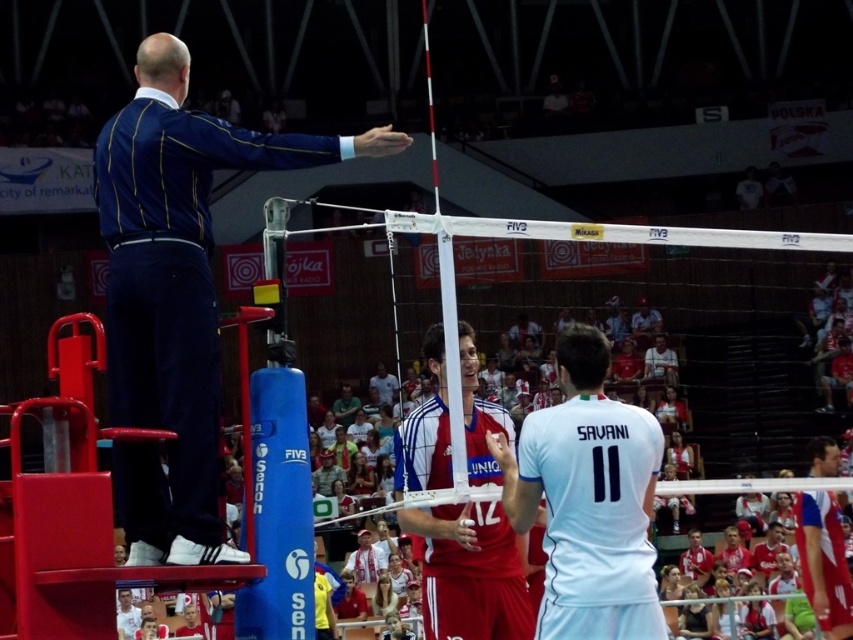
What is the 2D coordinate of the blue striped suit at upper left in the volleyball match scene?

The blue striped suit at upper left is located at the 2D coordinate point of [177,294].

You are a photographer standing at the back of the arena. You want to take a picture of the white jersey at center without the blue striped suit at upper left blocking it. Is this possible?

The blue striped suit at upper left is positioned over the white jersey at center, so it will block the view. Move to a different angle to avoid the obstruction.

You are a spectator sitting in the stands of the volleyball arena. You want to take a photo of the point at coordinates (628, 611). If your camera has a maximum focus range of 25 meters, will you be able to capture the point clearly?

The point at coordinates (628, 611) is 25.50 meters away from the viewer. Since the camera can only focus up to 25 meters, it won the focus range. Therefore, you won capture the point clearly.